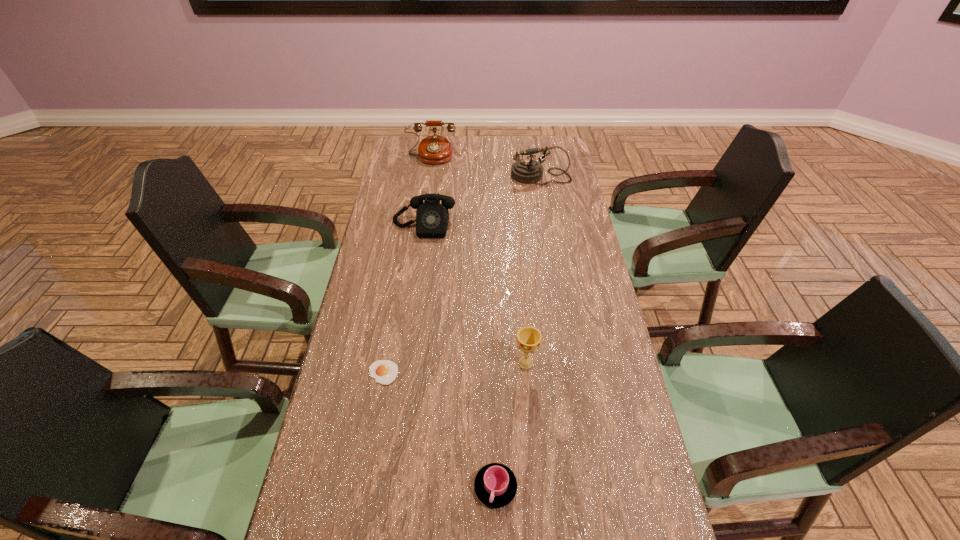
Where is `free space between the shortest object and the second nearest telephone`? The image size is (960, 540). free space between the shortest object and the second nearest telephone is located at coordinates (462, 274).

You are a GUI agent. You are given a task and a screenshot of the screen. Output one action in this format:
    pyautogui.click(x=<x>, y=<y>)
    Task: Click on the empty location between the fourth tallest object and the second farthest telephone
    
    Given the screenshot: What is the action you would take?
    (482, 201)

Locate which object ranks second in proximity to the egg yolk. Please provide its 2D coordinates. Your answer should be formatted as a tuple, i.e. [(x, y)], where the tuple contains the x and y coordinates of a point satisfying the conditions above.

[(529, 339)]

Locate an element on the screen. Image resolution: width=960 pixels, height=540 pixels. the fourth closest object relative to the shortest object is located at coordinates (527, 171).

Where is `telephone that stands as the closest to the egg yolk`? telephone that stands as the closest to the egg yolk is located at coordinates (432, 218).

Identify the location of the second closest telephone to the nearest telephone. This screenshot has height=540, width=960. (435, 149).

This screenshot has height=540, width=960. What are the coordinates of `free region that satisfies the following two spatial constraints: 1. on the back side of the shortest object; 2. on the left side of the second nearest telephone` in the screenshot? It's located at (418, 176).

Identify the location of vacant space that satisfies the following two spatial constraints: 1. on the dial of the chalice; 2. on the left side of the fourth nearest object. (405, 363).

In order to click on free space that satisfies the following two spatial constraints: 1. on the dial of the third farthest object; 2. on the right side of the chalice in this screenshot , I will do (405, 363).

This screenshot has width=960, height=540. In order to click on free location that satisfies the following two spatial constraints: 1. on the dial of the farthest object; 2. on the left side of the second nearest telephone in this screenshot , I will do `click(428, 176)`.